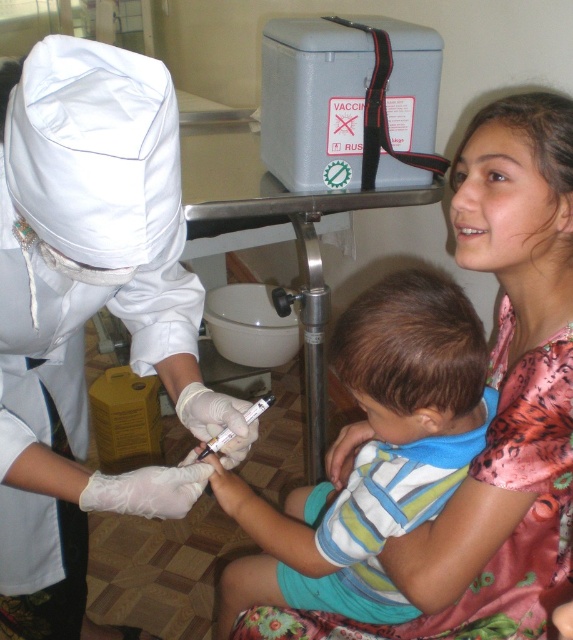
You are a medical equipment inspector checking the vaccination setup. You need to ensure that the white plastic syringe at center is not wider than the white matte uniform at center. Based on the scene, is this requirement met?

A: The white matte uniform at center might be wider than the white plastic syringe at center, so the requirement that the white plastic syringe at center is not wider than the white matte uniform at center is possibly met.

You are a medical intern who needs to disinfect the white plastic syringe at center before use. The disinfectant spray is located on the white matte uniform at center. Can you reach the disinfectant spray without moving either the syringe or the uniform?

The white matte uniform at center and white plastic syringe at center are 13.68 inches apart from each other. Since the spray is on the uniform, you can easily reach the disinfectant spray from the syringe without needing to move either object.